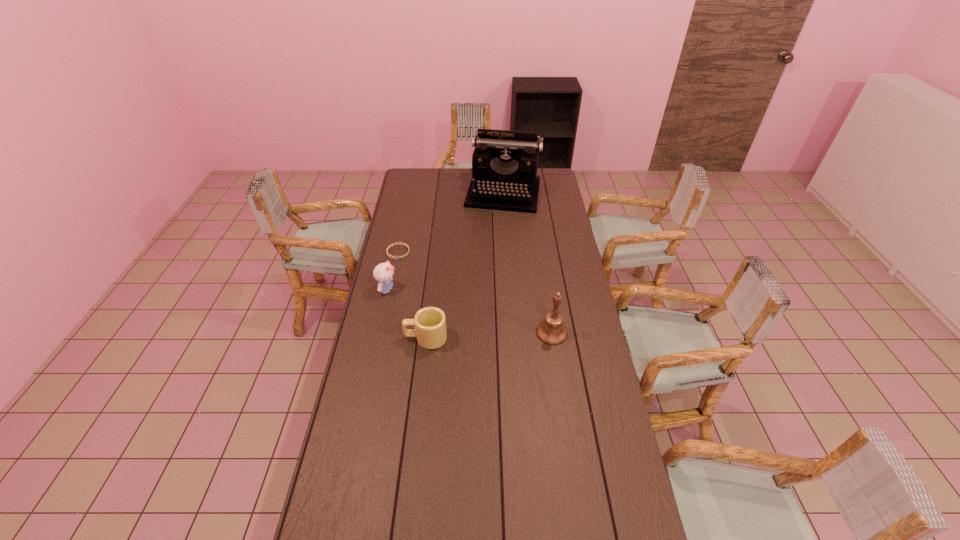
Where is `the second shortest object`? the second shortest object is located at coordinates (430, 331).

The image size is (960, 540). Identify the location of mug. (430, 331).

Image resolution: width=960 pixels, height=540 pixels. I want to click on the second tallest object, so click(x=551, y=331).

Identify the location of kitten. Image resolution: width=960 pixels, height=540 pixels. (383, 273).

Locate an element on the screen. the third shortest object is located at coordinates (383, 273).

The height and width of the screenshot is (540, 960). In order to click on the tallest object in this screenshot , I will do pyautogui.click(x=504, y=163).

The width and height of the screenshot is (960, 540). Identify the location of the farthest object. (504, 163).

The width and height of the screenshot is (960, 540). I want to click on the shortest object, so click(x=406, y=254).

The width and height of the screenshot is (960, 540). Identify the location of the second farthest object. (406, 254).

What are the coordinates of `vacant space located 0.140m with the handle on the side of the third object from right to left` in the screenshot? It's located at (369, 338).